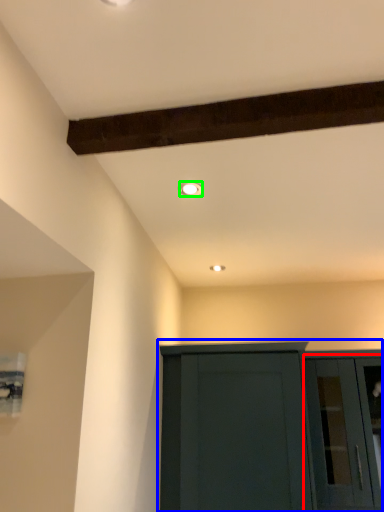
Question: Estimate the real-world distances between objects in this image. Which object is farther from glass door (highlighted by a red box), cupboard (highlighted by a blue box) or lighting (highlighted by a green box)?

Choices:
 (A) cupboard
 (B) lighting

Answer: (B)